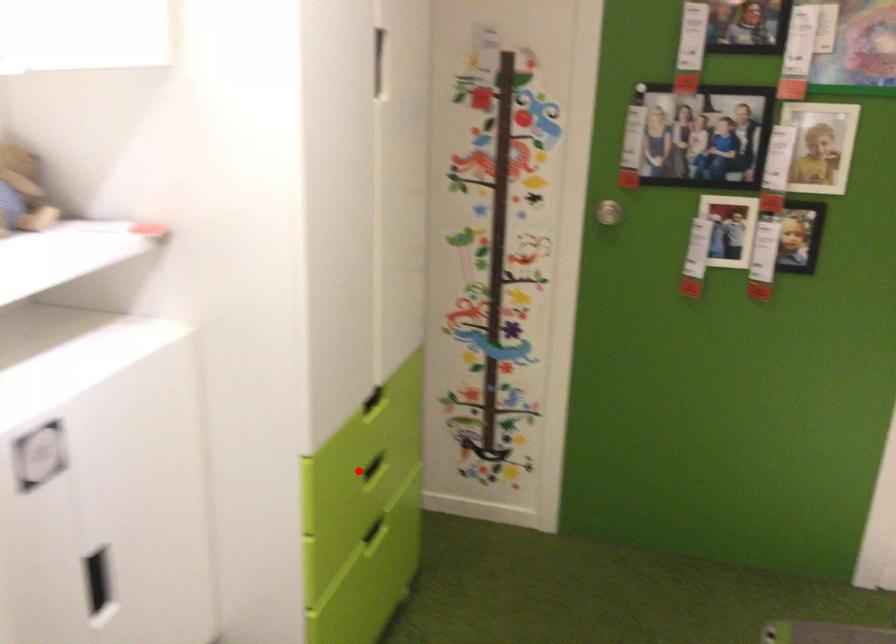
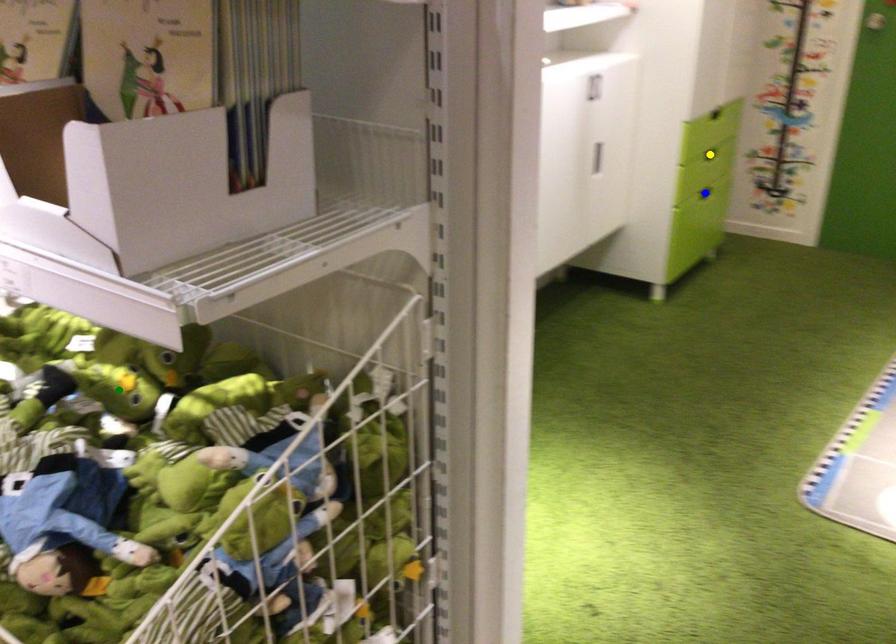
Question: I am providing you with two images of the same scene from different viewpoints. A red point is marked on the first image. You are given multiple points on the second image. Which point in image 2 is actually the same real-world point as the red point in image 1?

Choices:
 (A) green point
 (B) yellow point
 (C) blue point

Answer: (B)